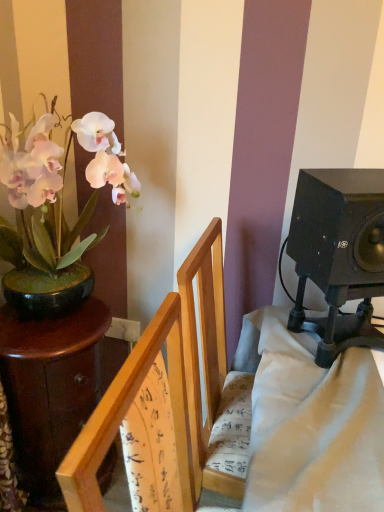
Question: Is black matte speaker at right situated inside dark brown wooden table at left or outside?

Choices:
 (A) inside
 (B) outside

Answer: (B)

Question: Is black matte speaker at right to the left or to the right of dark brown wooden table at left in the image?

Choices:
 (A) left
 (B) right

Answer: (B)

Question: Which of these objects is positioned closest to the wooden chair at center?

Choices:
 (A) white matte orchid at left
 (B) black matte speaker at right
 (C) dark brown wooden table at left

Answer: (B)

Question: Based on their relative distances, which object is nearer to the black matte speaker at right?

Choices:
 (A) wooden chair at center
 (B) dark brown wooden table at left
 (C) white matte orchid at left

Answer: (A)